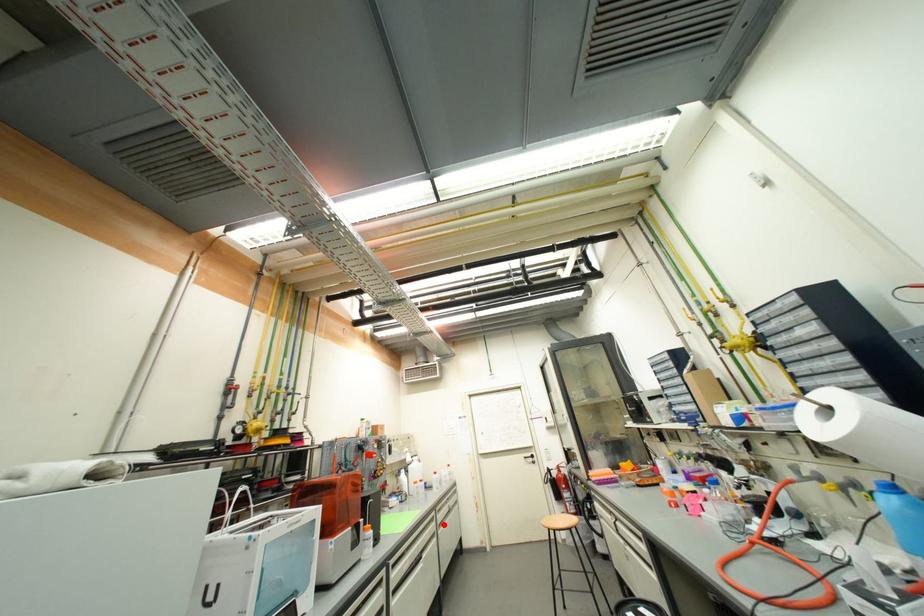
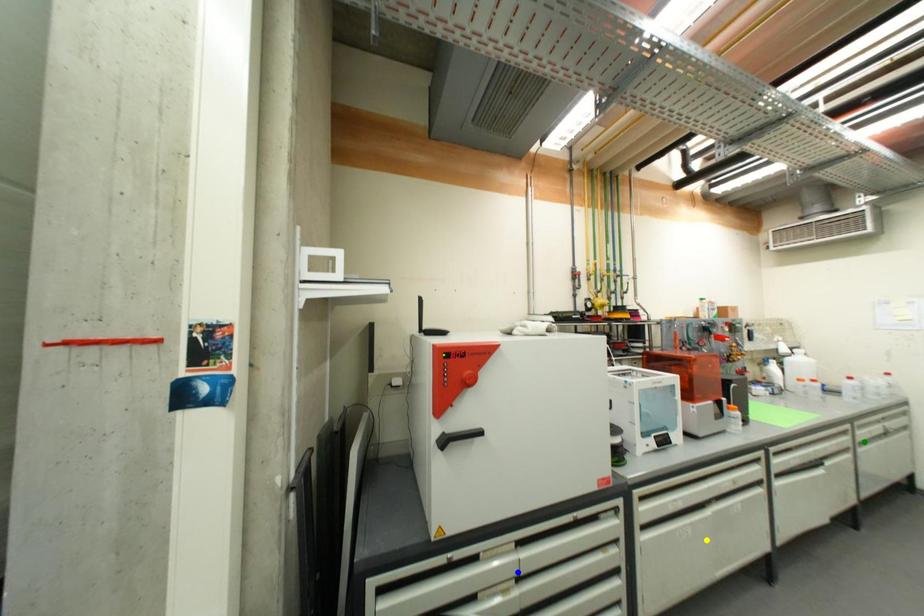
Question: I am providing you with two images of the same scene from different viewpoints. A red point is marked on the first image. You are given multiple points on the second image. Which spot in image 2 lines up with the point in image 1?

Choices:
 (A) green point
 (B) yellow point
 (C) blue point

Answer: (A)